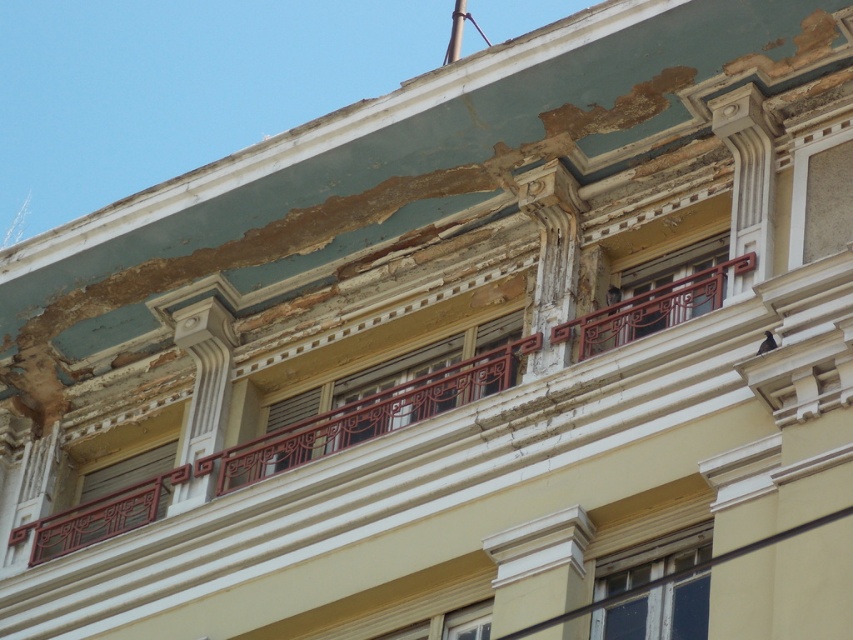
Question: Is wooden frame window at center wider than matte red railing at lower left?

Choices:
 (A) no
 (B) yes

Answer: (A)

Question: Which is farther from the wooden frame window at center?

Choices:
 (A) wooden lattice window at center
 (B) matte wood window at center

Answer: (B)

Question: Which point is closer to the camera taking this photo?

Choices:
 (A) (677, 298)
 (B) (94, 499)

Answer: (A)

Question: Where is wooden frame window at center located in relation to wooden lattice window at center in the image?

Choices:
 (A) right
 (B) left

Answer: (B)

Question: Can you confirm if wooden lattice window at center is positioned above matte red railing at lower left?

Choices:
 (A) yes
 (B) no

Answer: (A)

Question: Which point is closer to the camera?

Choices:
 (A) (79, 493)
 (B) (281, 436)
 (C) (604, 568)
 (D) (688, 284)

Answer: (C)